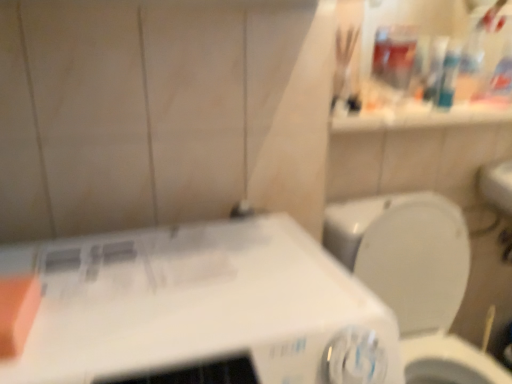
Question: Is white plastic washing machine at lower left shorter than orange matte soap at left?

Choices:
 (A) yes
 (B) no

Answer: (B)

Question: Does white plastic washing machine at lower left touch orange matte soap at left?

Choices:
 (A) no
 (B) yes

Answer: (A)

Question: From the image's perspective, does white plastic washing machine at lower left appear higher than orange matte soap at left?

Choices:
 (A) yes
 (B) no

Answer: (B)

Question: From a real-world perspective, is white plastic washing machine at lower left beneath orange matte soap at left?

Choices:
 (A) no
 (B) yes

Answer: (B)

Question: Is white plastic washing machine at lower left far away from orange matte soap at left?

Choices:
 (A) no
 (B) yes

Answer: (A)

Question: Based on their sizes in the image, would you say orange matte soap at left is bigger or smaller than white plastic washing machine at lower left?

Choices:
 (A) small
 (B) big

Answer: (A)

Question: From the image's perspective, is orange matte soap at left above or below white plastic washing machine at lower left?

Choices:
 (A) below
 (B) above

Answer: (B)

Question: Is orange matte soap at left taller or shorter than white plastic washing machine at lower left?

Choices:
 (A) tall
 (B) short

Answer: (B)

Question: Is point (14, 294) closer or farther from the camera than point (307, 304)?

Choices:
 (A) closer
 (B) farther

Answer: (A)

Question: From a real-world perspective, relative to white plastic washing machine at lower left, is white glossy toilet at right vertically above or below?

Choices:
 (A) below
 (B) above

Answer: (A)

Question: In the image, is white glossy toilet at right positioned in front of or behind white plastic washing machine at lower left?

Choices:
 (A) front
 (B) behind

Answer: (B)

Question: In terms of height, does white glossy toilet at right look taller or shorter compared to white plastic washing machine at lower left?

Choices:
 (A) tall
 (B) short

Answer: (A)

Question: Does point (444, 256) appear closer or farther from the camera than point (227, 322)?

Choices:
 (A) closer
 (B) farther

Answer: (B)

Question: From the image's perspective, is white plastic washing machine at lower left positioned above or below orange matte soap at left?

Choices:
 (A) below
 (B) above

Answer: (A)

Question: Does point (186, 317) appear closer or farther from the camera than point (22, 331)?

Choices:
 (A) farther
 (B) closer

Answer: (A)